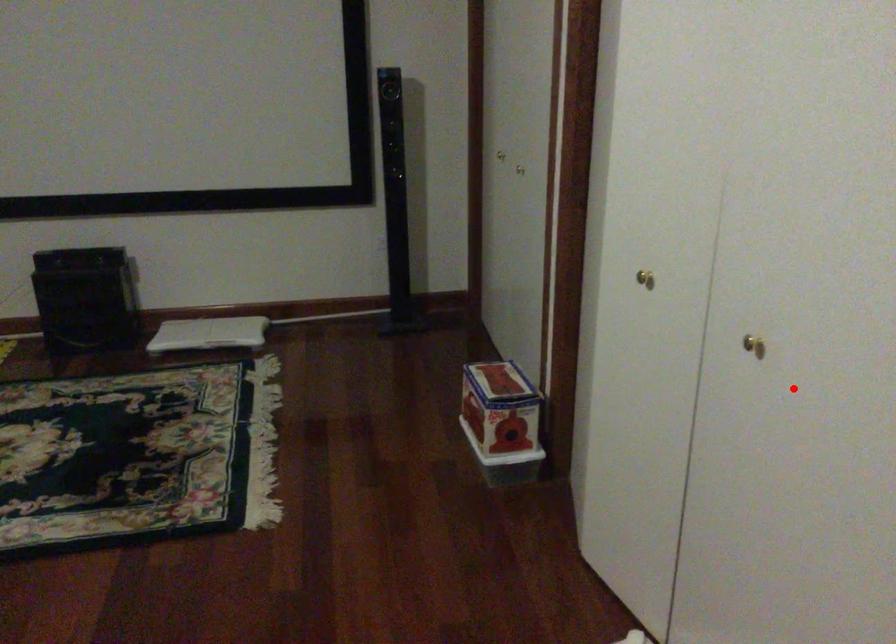
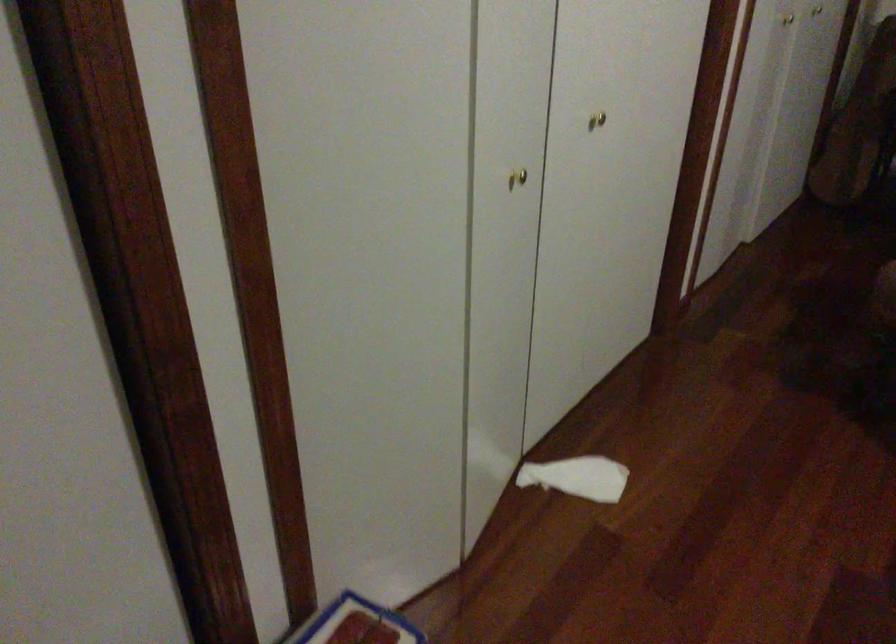
Locate, in the second image, the point that corresponds to the highlighted location in the first image.

(597, 120)